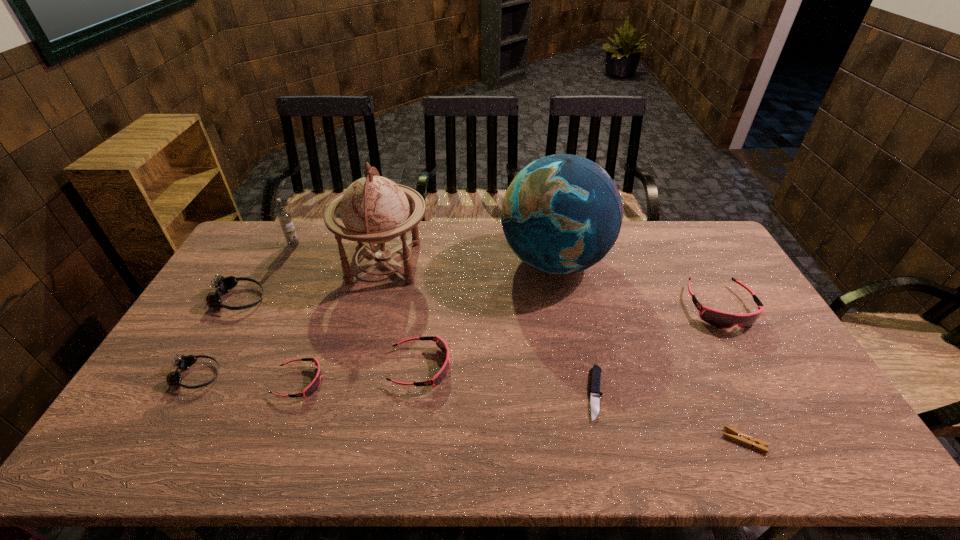
The height and width of the screenshot is (540, 960). Identify the location of the smallest pink goggles. [x=312, y=388].

The height and width of the screenshot is (540, 960). I want to click on steak knife, so click(x=595, y=392).

The height and width of the screenshot is (540, 960). I want to click on the nearest object, so click(743, 438).

This screenshot has height=540, width=960. In order to click on free space located on the front of the blue globe in this screenshot , I will do `click(577, 381)`.

Locate an element on the screen. This screenshot has height=540, width=960. vacant space located at the front of the left globe showing Africa is located at coordinates (475, 262).

Where is `vacant space located 0.290m on the label of the vodka`? This screenshot has height=540, width=960. vacant space located 0.290m on the label of the vodka is located at coordinates (263, 303).

Locate an element on the screen. vacant space positioned on the front-facing side of the biggest pink goggles is located at coordinates (788, 428).

In order to click on vacant space located 0.260m through the lenses of the bigger bronze goggles in this screenshot , I will do `click(346, 299)`.

Where is `vacant space situated 0.090m on the front-facing side of the second smallest pink goggles`? The width and height of the screenshot is (960, 540). vacant space situated 0.090m on the front-facing side of the second smallest pink goggles is located at coordinates (483, 367).

The width and height of the screenshot is (960, 540). I want to click on vacant space located 0.250m through the lenses of the smaller bronze goggles, so click(x=312, y=376).